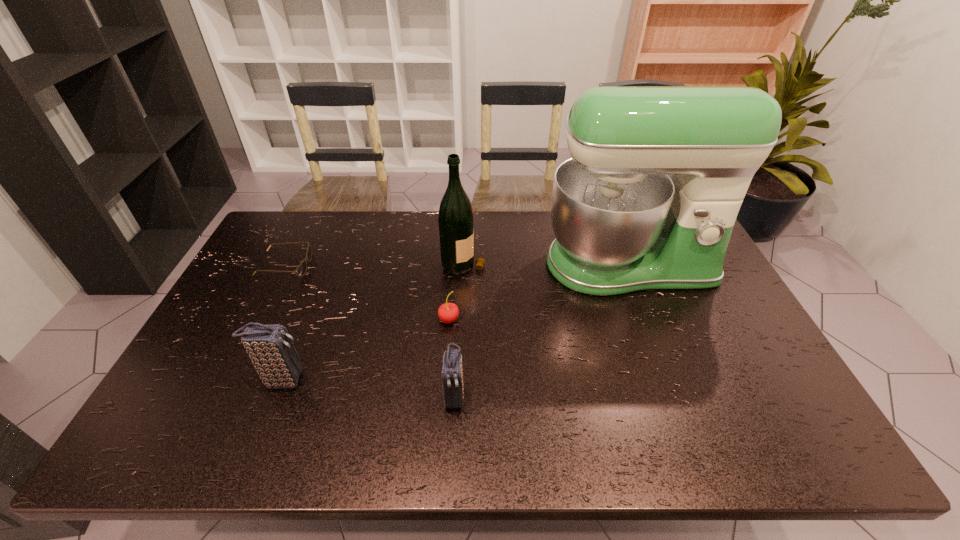
Find the location of a particular element. free space at the far edge of the desktop is located at coordinates coord(346,236).

Image resolution: width=960 pixels, height=540 pixels. What are the coordinates of `free space at the near edge` in the screenshot? It's located at (401, 407).

Where is `free space at the left edge`? The width and height of the screenshot is (960, 540). free space at the left edge is located at coordinates (279, 262).

In the image, there is a desktop. At what (x,y) coordinates should I click in order to perform the action: click on free space at the right edge. Please return your answer as a coordinate pair (x, y). Looking at the image, I should click on (739, 356).

The image size is (960, 540). In the image, there is a desktop. Identify the location of vacant space at the far left corner. (285, 251).

Where is `free space between the second shortest object and the taller clutch bag`? This screenshot has width=960, height=540. free space between the second shortest object and the taller clutch bag is located at coordinates (366, 350).

Find the location of a particular element. The width and height of the screenshot is (960, 540). free spot between the left clutch bag and the second tallest object is located at coordinates (373, 321).

You are a GUI agent. You are given a task and a screenshot of the screen. Output one action in this format:
    pyautogui.click(x=<x>, y=<y>)
    Task: Click on the empty space between the wine bottle and the taller clutch bag
    The width and height of the screenshot is (960, 540).
    Given the screenshot: What is the action you would take?
    pyautogui.click(x=373, y=321)

This screenshot has width=960, height=540. I want to click on vacant area between the sunglasses and the second shortest object, so click(367, 293).

Where is `unoccupied area between the second shortest object and the fifth shortest object`? unoccupied area between the second shortest object and the fifth shortest object is located at coordinates (456, 291).